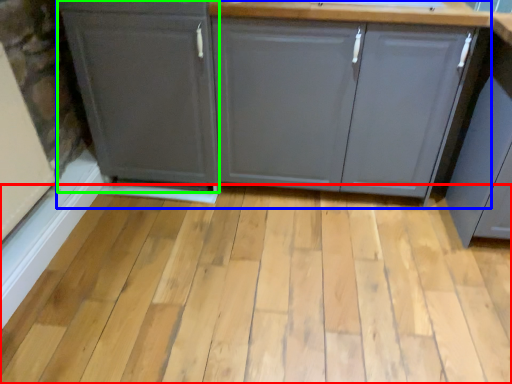
Question: Which object is the farthest from plank (highlighted by a red box)? Choose among these: cabinetry (highlighted by a blue box) or cabinetry (highlighted by a green box).

Choices:
 (A) cabinetry
 (B) cabinetry

Answer: (B)